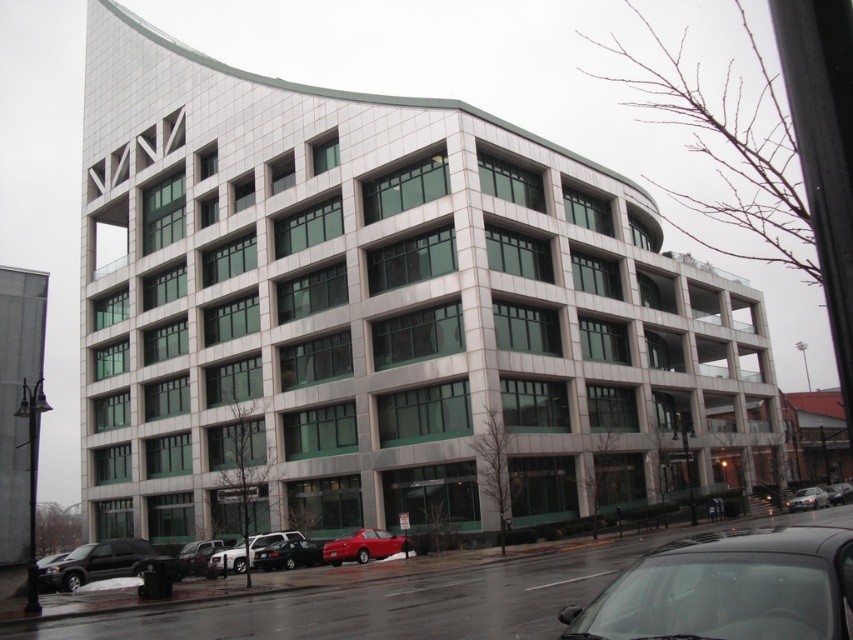
Question: Which point appears farthest from the camera in this image?

Choices:
 (A) (827, 490)
 (B) (119, 538)
 (C) (811, 627)
 (D) (186, 570)

Answer: (B)

Question: Does silver metallic sedan at lower right come behind shiny black sedan at center?

Choices:
 (A) no
 (B) yes

Answer: (A)

Question: Estimate the real-world distances between objects in this image. Which object is closer to the shiny silver sedan at lower left?

Choices:
 (A) shiny black sedan at center
 (B) shiny black sedan at lower center

Answer: (B)

Question: Does shiny black suv at lower left have a smaller size compared to shiny black sedan at center?

Choices:
 (A) yes
 (B) no

Answer: (A)

Question: Is shiny red sedan at lower center further to camera compared to shiny black sedan at center?

Choices:
 (A) yes
 (B) no

Answer: (B)

Question: Which point appears closest to the camera in this image?

Choices:
 (A) (694, 570)
 (B) (833, 497)
 (C) (357, 547)

Answer: (A)